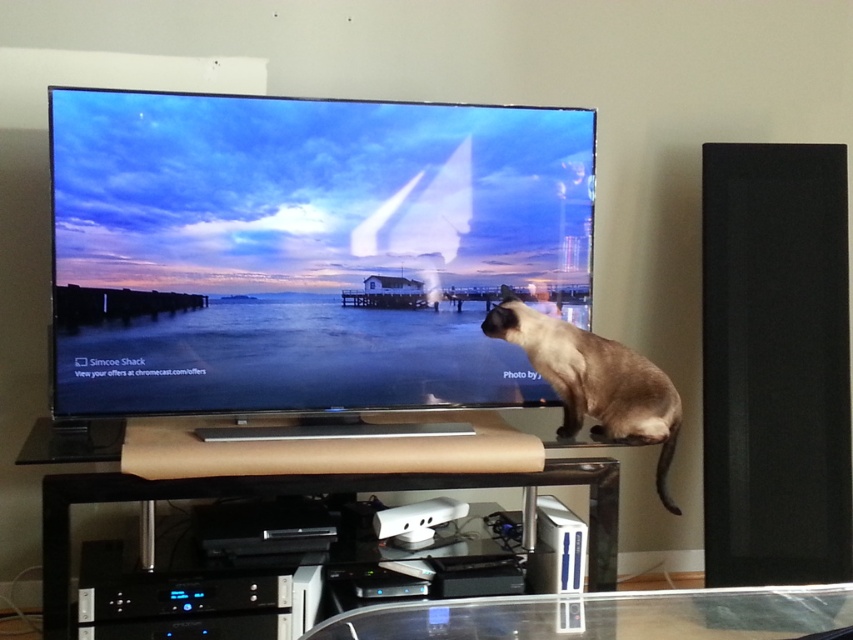
Between transparent glass table at lower center and transparent glass entertainment center at lower center, which one is positioned lower?

transparent glass table at lower center

Does transparent glass table at lower center lie in front of transparent glass entertainment center at lower center?

Yes, it is.

Identify the location of transparent glass table at lower center. (606, 616).

At what (x,y) coordinates should I click in order to perform the action: click on matte black flat screen tv at center. Please return your answer as a coordinate pair (x, y). This screenshot has width=853, height=640. Looking at the image, I should click on (306, 250).

Who is more distant from viewer, (491, 340) or (608, 508)?

The point (491, 340) is more distant.

Identify the location of matte black flat screen tv at center. (306, 250).

Does transparent glass table at lower center have a greater height compared to smokey brown fur at upper right?

No.

The width and height of the screenshot is (853, 640). What are the coordinates of `transparent glass table at lower center` in the screenshot? It's located at (606, 616).